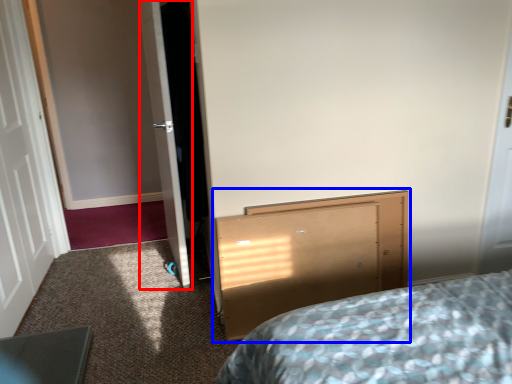
Question: Which object appears closest to the camera in this image, door (highlighted by a red box) or vanity (highlighted by a blue box)?

Choices:
 (A) door
 (B) vanity

Answer: (B)